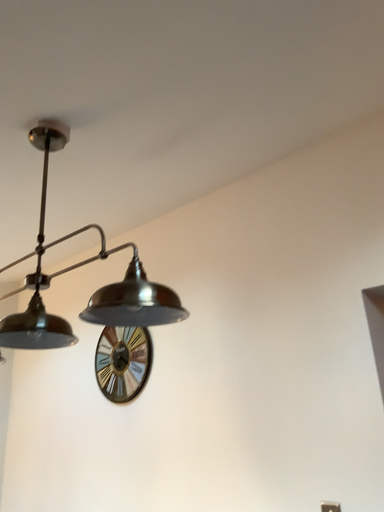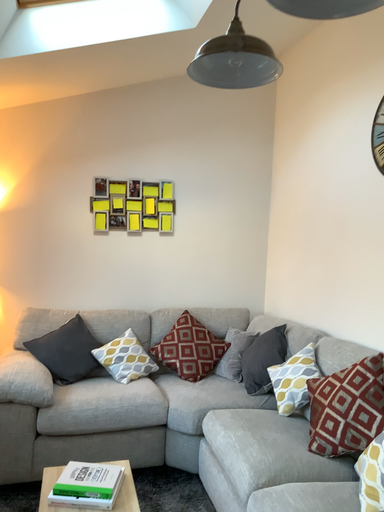
Question: How did the camera likely rotate when shooting the video?

Choices:
 (A) rotated right
 (B) rotated left

Answer: (B)